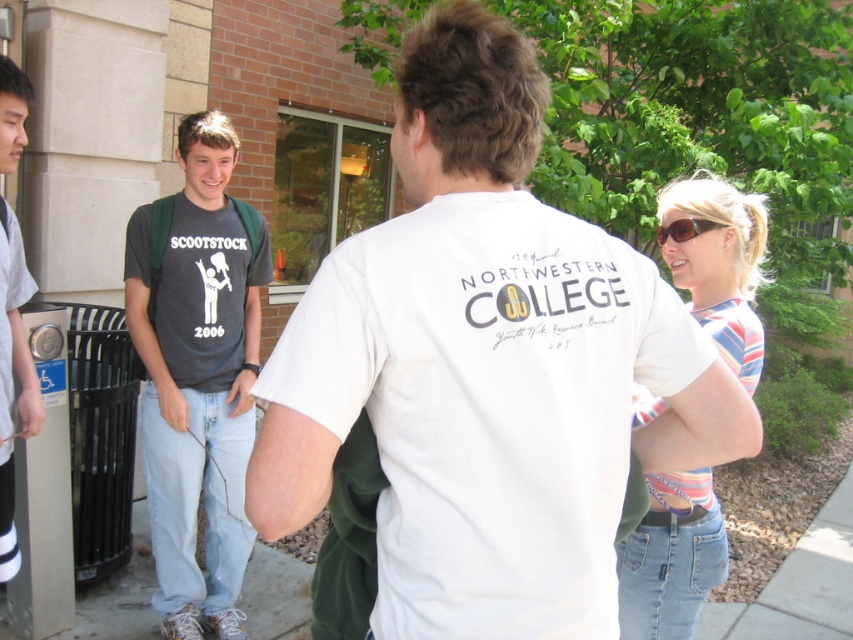
Question: Considering the real-world distances, which object is closest to the white cotton t-shirt at center?

Choices:
 (A) dark gray t-shirt at center
 (B) gray cotton shirt at left
 (C) brown matte sunglasses at upper right

Answer: (C)

Question: Can you confirm if white cotton t-shirt at center is positioned above gray cotton shirt at left?

Choices:
 (A) yes
 (B) no

Answer: (A)

Question: Among these points, which one is nearest to the camera?

Choices:
 (A) (419, 442)
 (B) (26, 388)
 (C) (682, 240)

Answer: (A)

Question: Does gray cotton shirt at left appear on the left side of brown matte sunglasses at upper right?

Choices:
 (A) yes
 (B) no

Answer: (A)

Question: Can you confirm if dark gray t-shirt at center is thinner than brown matte sunglasses at upper right?

Choices:
 (A) no
 (B) yes

Answer: (A)

Question: Which of these objects is positioned closest to the dark gray t-shirt at center?

Choices:
 (A) gray cotton shirt at left
 (B) brown matte sunglasses at upper right
 (C) white cotton t-shirt at center

Answer: (A)